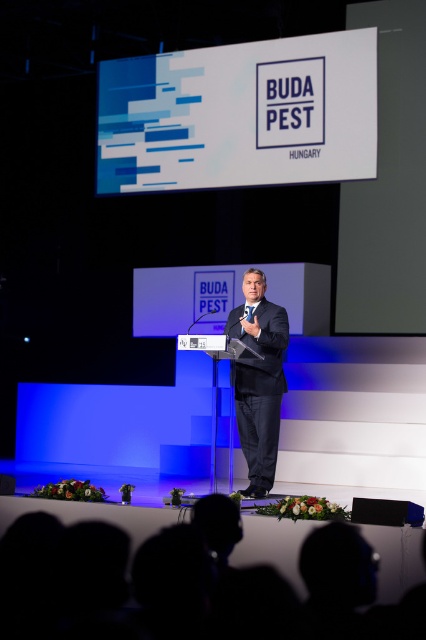
Question: Among these objects, which one is nearest to the camera?

Choices:
 (A) dark suit at center
 (B) white matte sign at upper center

Answer: (A)

Question: Is white matte sign at upper center smaller than dark suit at center?

Choices:
 (A) no
 (B) yes

Answer: (A)

Question: Is white matte sign at upper center positioned at the back of dark suit at center?

Choices:
 (A) no
 (B) yes

Answer: (B)

Question: Can you confirm if white matte sign at upper center is positioned to the right of dark suit at center?

Choices:
 (A) no
 (B) yes

Answer: (A)